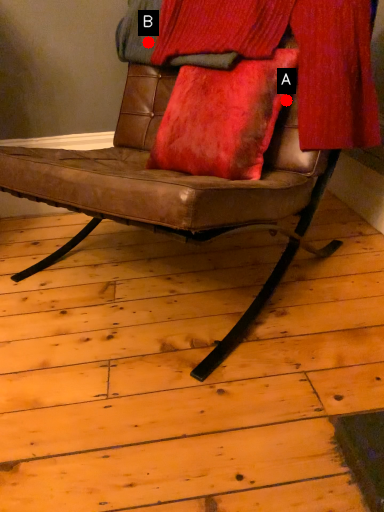
Question: Two points are circled on the image, labeled by A and B beside each circle. Which point is further to the camera?

Choices:
 (A) A is further
 (B) B is further

Answer: (B)